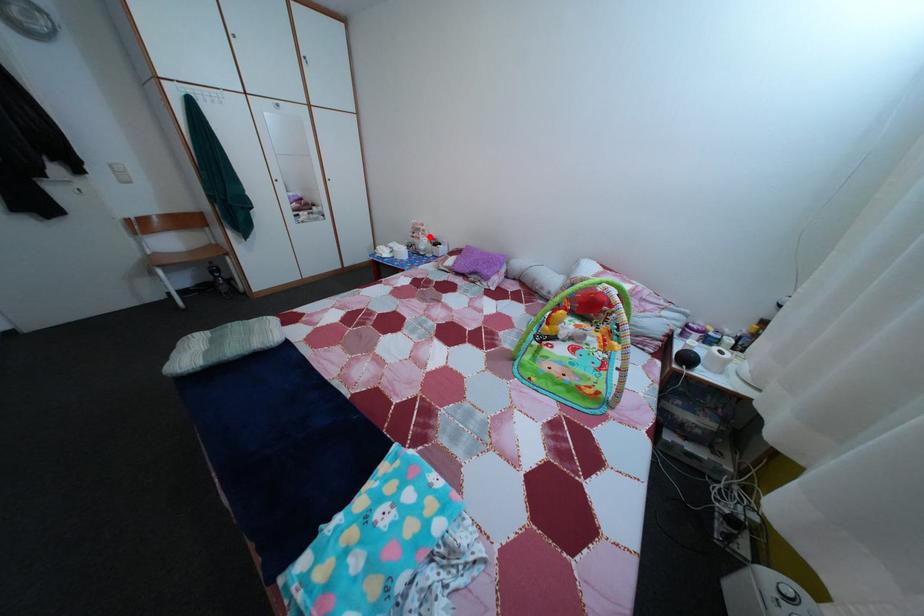
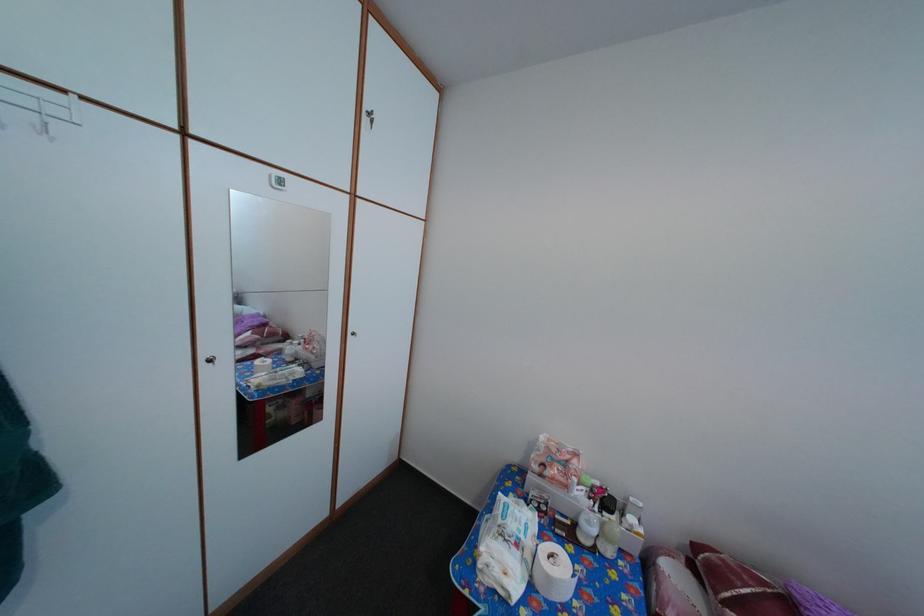
Question: I am providing you with two images of the same scene from different viewpoints. A red point is marked on the first image. Can you still see the location of the red point in image 2?

Choices:
 (A) Yes
 (B) No

Answer: (A)